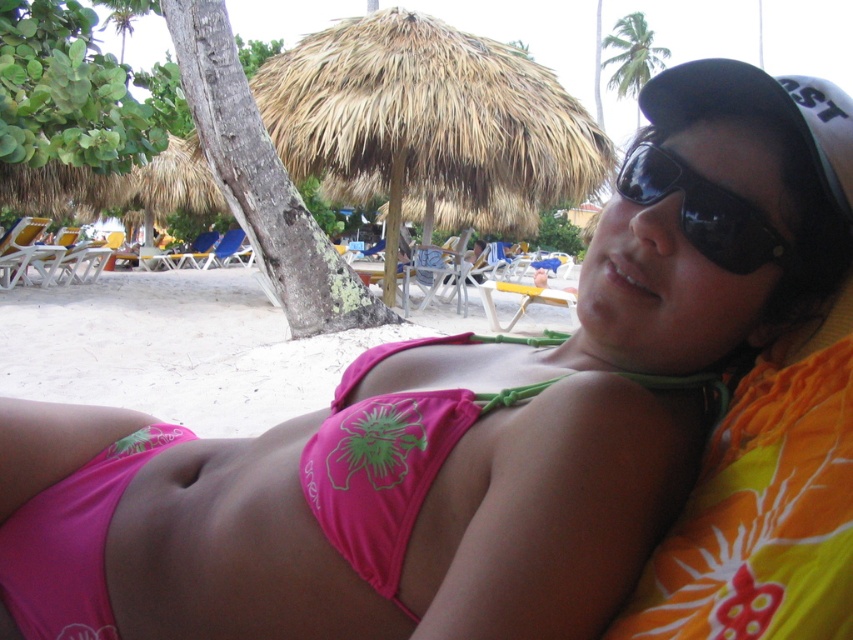
Question: Can you confirm if pink fabric bikini top at center is positioned to the left of black plastic sunglasses at upper right?

Choices:
 (A) no
 (B) yes

Answer: (B)

Question: Considering the relative positions of pink fabric bikini top at center and black plastic sunglasses at upper right in the image provided, where is pink fabric bikini top at center located with respect to black plastic sunglasses at upper right?

Choices:
 (A) right
 (B) left

Answer: (B)

Question: From the image, what is the correct spatial relationship of pink fabric bikini top at center in relation to black plastic sunglasses at upper right?

Choices:
 (A) above
 (B) below

Answer: (B)

Question: Which of the following is the farthest from the observer?

Choices:
 (A) black plastic sunglasses at upper right
 (B) pink fabric bikini top at center

Answer: (A)

Question: Which point appears farthest from the camera in this image?

Choices:
 (A) (341, 454)
 (B) (683, 196)

Answer: (A)

Question: Which point is farther to the camera?

Choices:
 (A) black plastic sunglasses at upper right
 (B) pink fabric bikini top at center

Answer: (A)